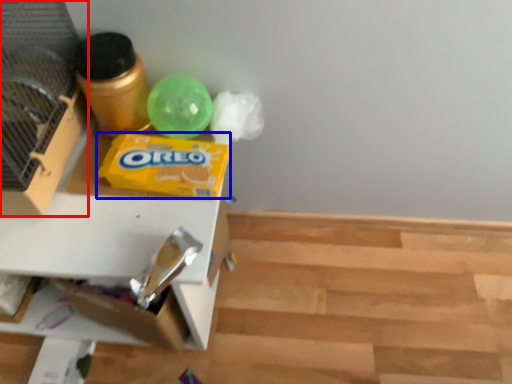
Question: Which of the following is the farthest to the observer, bird cage (highlighted by a red box) or waste (highlighted by a blue box)?

Choices:
 (A) bird cage
 (B) waste

Answer: (B)